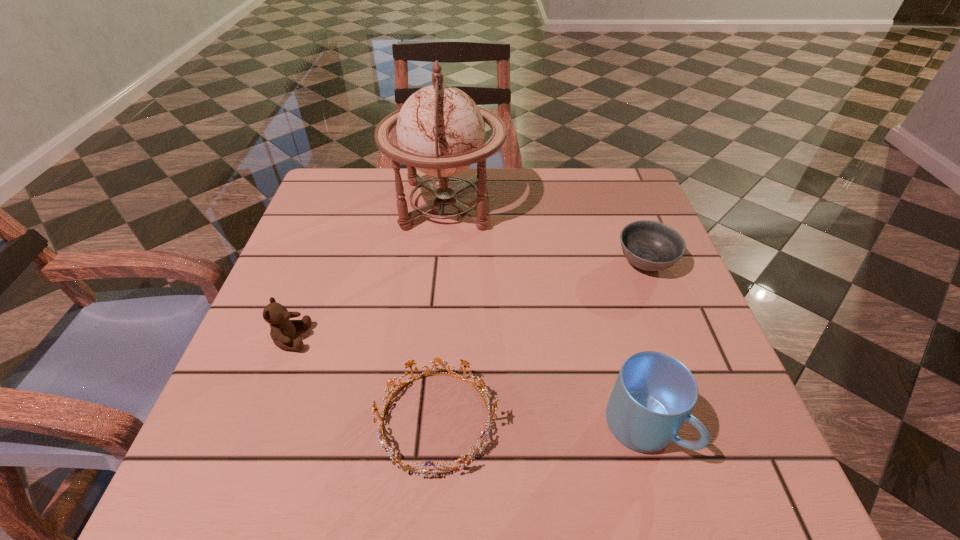
Find the location of `vacant space at the left edge`. vacant space at the left edge is located at coordinates (245, 430).

Image resolution: width=960 pixels, height=540 pixels. In order to click on vacant area at the right edge of the desktop in this screenshot , I will do `click(654, 295)`.

The height and width of the screenshot is (540, 960). What are the coordinates of `vacant region at the far left corner of the desktop` in the screenshot? It's located at (324, 180).

At what (x,y) coordinates should I click in order to perform the action: click on vacant area that lies between the globe and the third shortest object. Please return your answer as a coordinate pair (x, y). Looking at the image, I should click on tap(369, 272).

Image resolution: width=960 pixels, height=540 pixels. What are the coordinates of `free spot between the fourth shortest object and the tiara` in the screenshot? It's located at (540, 424).

The image size is (960, 540). Find the location of `empty space between the tallest object and the teddy bear`. empty space between the tallest object and the teddy bear is located at coordinates (369, 272).

Locate an element on the screen. free spot between the tiara and the tallest object is located at coordinates (442, 313).

The image size is (960, 540). What are the coordinates of `free space between the tiara and the fourth shortest object` in the screenshot? It's located at (540, 424).

Where is `free area in between the fourth shortest object and the tiara`? Image resolution: width=960 pixels, height=540 pixels. free area in between the fourth shortest object and the tiara is located at coordinates (540, 424).

You are a GUI agent. You are given a task and a screenshot of the screen. Output one action in this format:
    pyautogui.click(x=<x>, y=<y>)
    Task: Click on the free point between the fourth shortest object and the tiara
    
    Given the screenshot: What is the action you would take?
    pyautogui.click(x=540, y=424)